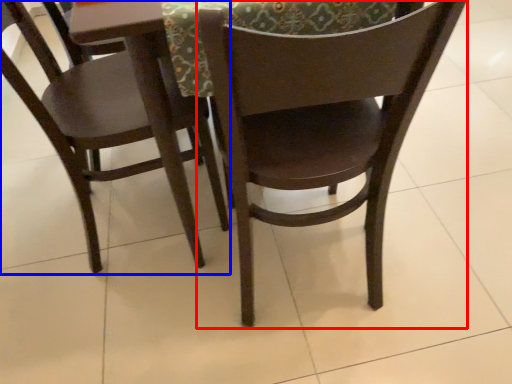
Question: Which object is closer to the camera taking this photo, chair (highlighted by a red box) or chair (highlighted by a blue box)?

Choices:
 (A) chair
 (B) chair

Answer: (A)